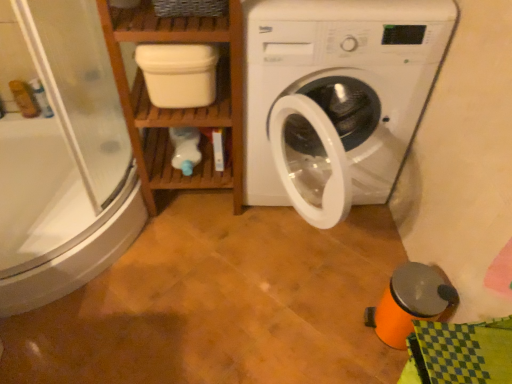
Question: Can you confirm if transparent glass shower door at left is thinner than wooden shelf at left?

Choices:
 (A) yes
 (B) no

Answer: (B)

Question: Is transparent glass shower door at left taller than wooden shelf at left?

Choices:
 (A) yes
 (B) no

Answer: (B)

Question: Is transparent glass shower door at left at the right side of wooden shelf at left?

Choices:
 (A) no
 (B) yes

Answer: (A)

Question: From the image's perspective, is transparent glass shower door at left located beneath wooden shelf at left?

Choices:
 (A) yes
 (B) no

Answer: (A)

Question: From a real-world perspective, is transparent glass shower door at left below wooden shelf at left?

Choices:
 (A) no
 (B) yes

Answer: (A)

Question: In the image, is white matte container at upper center positioned in front of or behind white plastic washing machine at center?

Choices:
 (A) behind
 (B) front

Answer: (A)

Question: Considering the positions of point (186, 56) and point (326, 74), is point (186, 56) closer or farther from the camera than point (326, 74)?

Choices:
 (A) closer
 (B) farther

Answer: (A)

Question: From a real-world perspective, relative to white plastic washing machine at center, is white matte container at upper center vertically above or below?

Choices:
 (A) below
 (B) above

Answer: (B)

Question: Is white matte container at upper center taller or shorter than white plastic washing machine at center?

Choices:
 (A) short
 (B) tall

Answer: (A)

Question: In terms of size, does transparent glass shower door at left appear bigger or smaller than white plastic washing machine at center?

Choices:
 (A) big
 (B) small

Answer: (B)

Question: Choose the correct answer: Is transparent glass shower door at left inside white plastic washing machine at center or outside it?

Choices:
 (A) inside
 (B) outside

Answer: (B)

Question: From the image's perspective, is transparent glass shower door at left located above or below white plastic washing machine at center?

Choices:
 (A) above
 (B) below

Answer: (A)

Question: In terms of width, does transparent glass shower door at left look wider or thinner when compared to white plastic washing machine at center?

Choices:
 (A) thin
 (B) wide

Answer: (B)

Question: Relative to white matte container at upper center, is wooden shelf at left in front or behind?

Choices:
 (A) front
 (B) behind

Answer: (A)

Question: Looking at their shapes, would you say wooden shelf at left is wider or thinner than white matte container at upper center?

Choices:
 (A) thin
 (B) wide

Answer: (B)